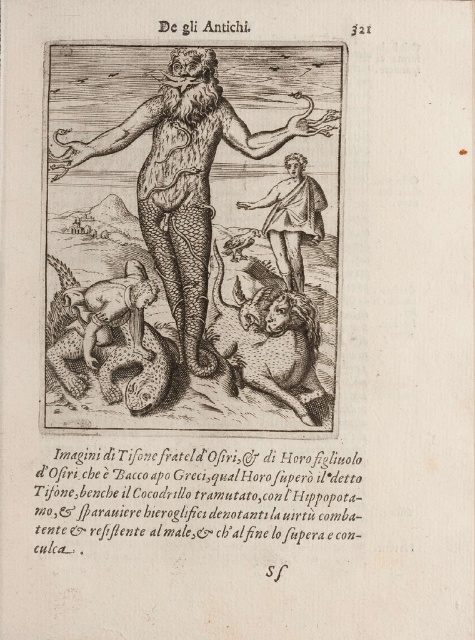
Does brown textured skin deity at center appear over smooth white toga at center?

Indeed, brown textured skin deity at center is positioned over smooth white toga at center.

You are a GUI agent. You are given a task and a screenshot of the screen. Output one action in this format:
    pyautogui.click(x=<x>, y=<y>)
    Task: Click on the brown textured skin deity at center
    The image size is (475, 640).
    Given the screenshot: What is the action you would take?
    pyautogui.click(x=186, y=176)